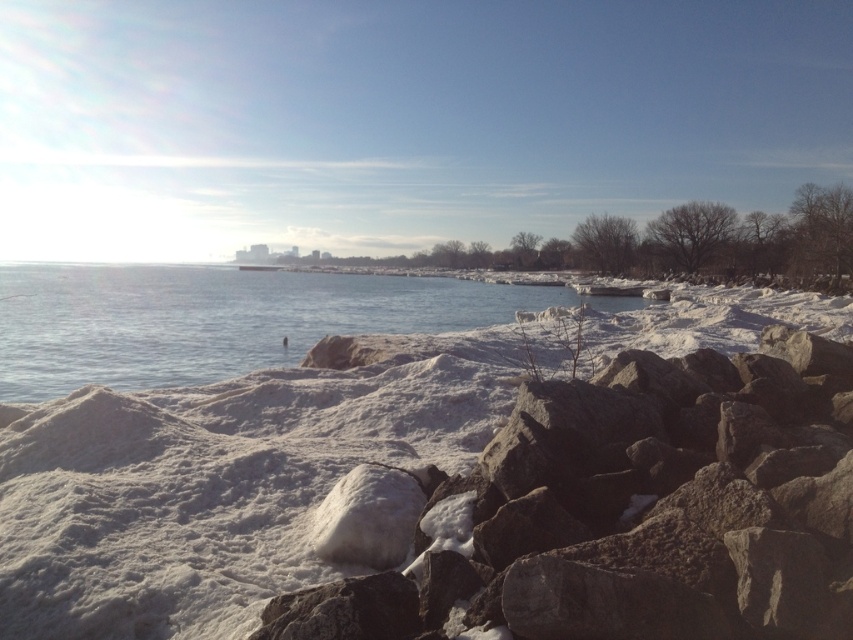
You are an explorer trying to cross the area shown in the image. You need to reach the clear water at center from your current position near the white fluffy snow at lower left. Based on the snow and water conditions described, which path would be safer to avoid sinking? Explain your reasoning using the objects mentioned.

The white fluffy snow at lower left is thinner than the clear water at center, so the clear water at center is more stable. Therefore, moving towards the clear water at center would be safer to avoid sinking since the snow at lower left might not support your weight due to its thinness.

You are an explorer trying to cross the area shown in the image. You need to know which area takes up more space between the white fluffy snow at lower left and the clear water at center. Which one should you consider larger?

The clear water at center occupies more space than the white fluffy snow at lower left, so you should consider the clear water at center as the larger area.